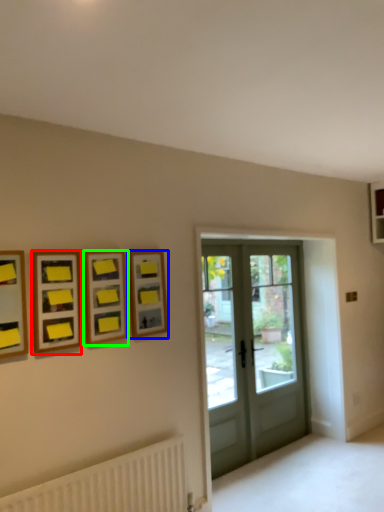
Question: Which is farther away from picture frame (highlighted by a red box)? picture frame (highlighted by a blue box) or picture frame (highlighted by a green box)?

Choices:
 (A) picture frame
 (B) picture frame

Answer: (A)